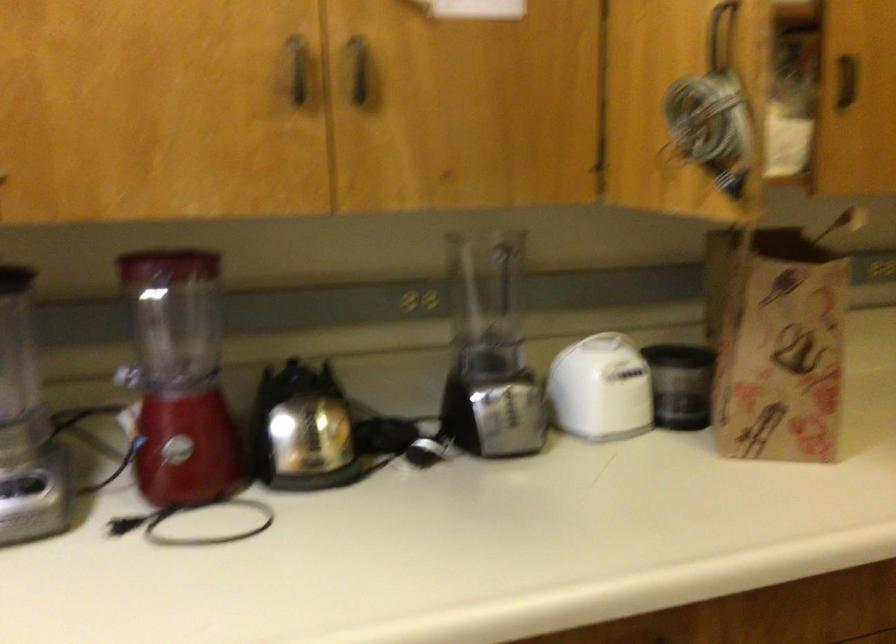
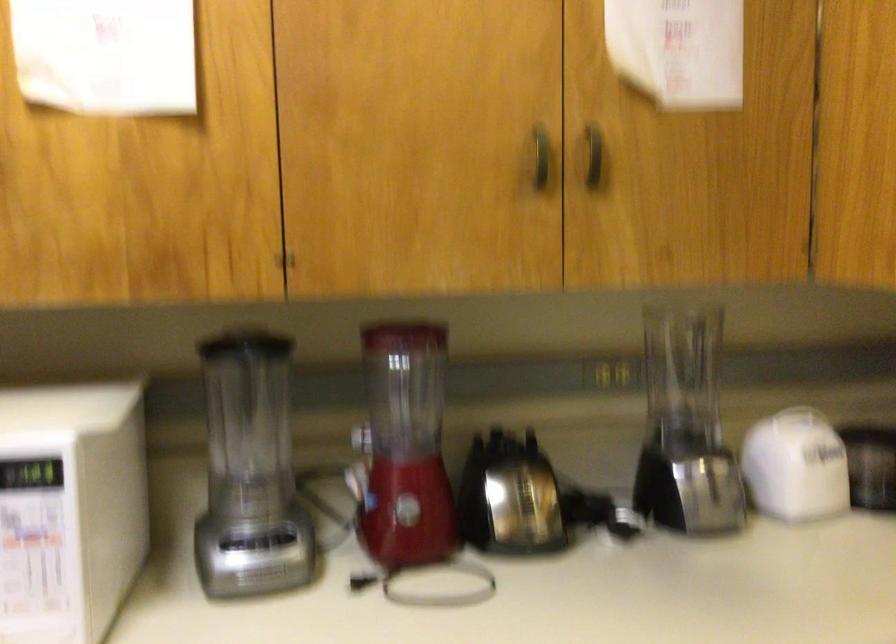
Which direction would the cameraman need to move to produce the second image?

The cameraman moved toward left, backward.